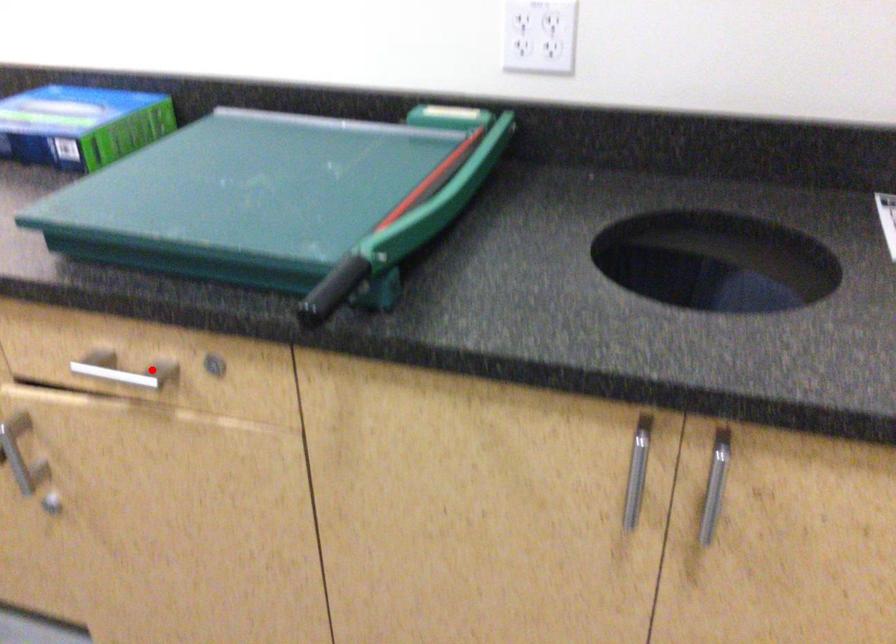
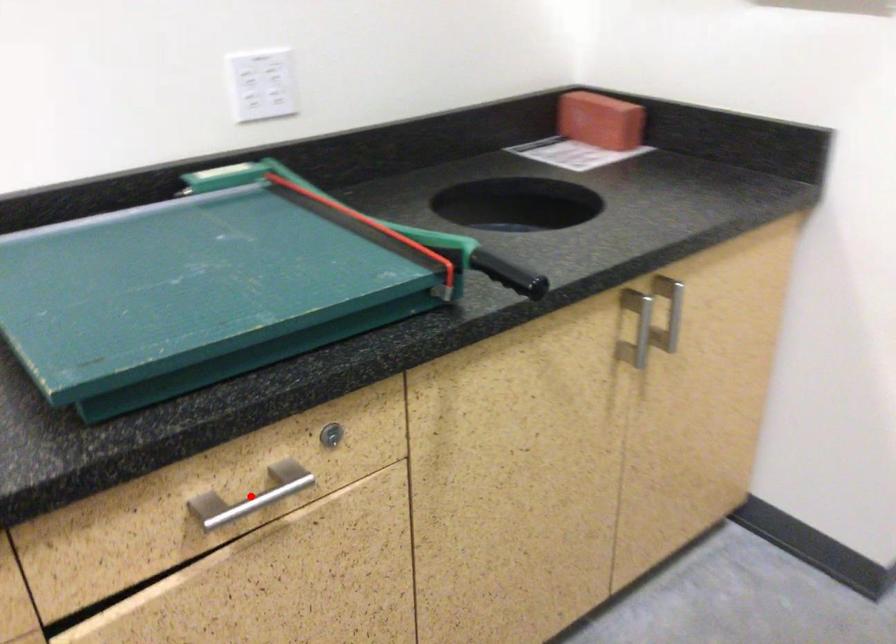
I am providing you with two images of the same scene from different viewpoints. A red point is marked on the first image and another point is marked on the second image. Does the point marked in image1 correspond to the same location as the one in image2?

Yes